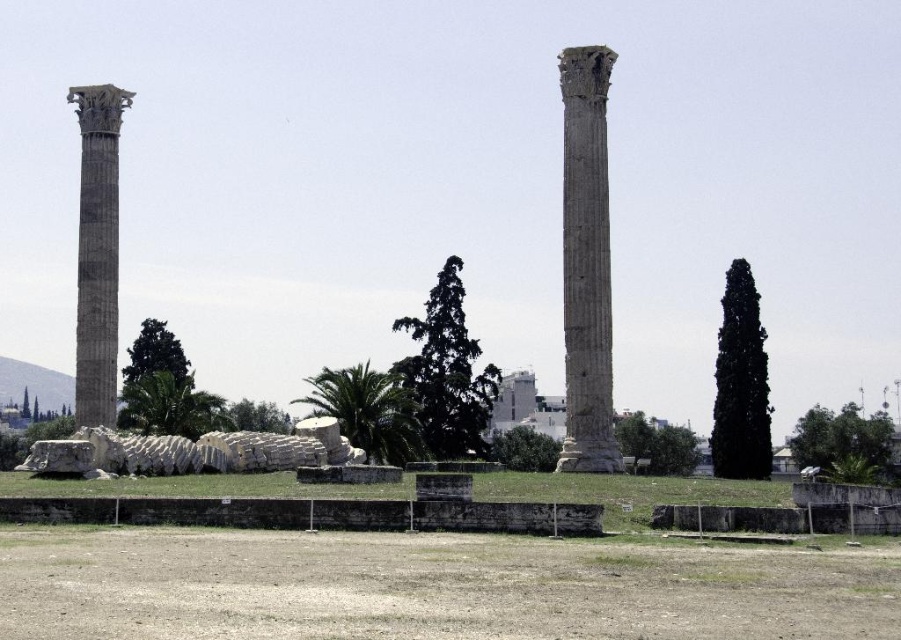
You are a tour guide leading a group to the Temple of Olympian Zeus. You want to ensure your group can safely walk between the smooth stone column at center and the marble column at left. The path between them is 39.36 meters wide. Can your group walk through this path comfortably?

The path between the smooth stone column at center and the marble column at left is 39.36 meters wide, so yes, the group can walk through this path comfortably as it is sufficiently wide for safe passage.

You are an archaeologist examining the Temple of Olympian Zeus. You notice the smooth stone column at center and the marble column at left. Which column is narrower?

The smooth stone column at center has a lesser width compared to the marble column at left, so the smooth stone column at center is narrower.

You are standing at the entrance of the Temple of Olympian Zeus ruins and want to take a photo of the two tall columns. The camera you have can focus on objects up to 100 meters away. Is the point at coordinates point (579, 396) within the camera focus range?

The distance of point (579, 396) from camera is 106.88 meters, which is beyond the camera focus range of 100 meters. Therefore, the point is out of focus.